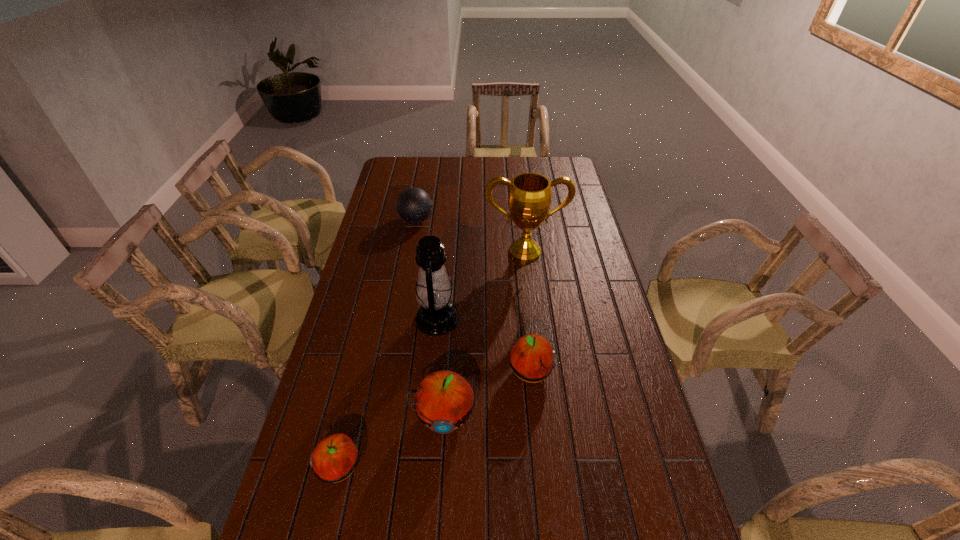
Select which object appears as the fifth closest to the bowling ball. Please provide its 2D coordinates. Your answer should be formatted as a tuple, i.e. [(x, y)], where the tuple contains the x and y coordinates of a point satisfying the conditions above.

[(335, 457)]

Select which apple is the closest to the bowling ball. Please provide its 2D coordinates. Your answer should be formatted as a tuple, i.e. [(x, y)], where the tuple contains the x and y coordinates of a point satisfying the conditions above.

[(532, 358)]

This screenshot has width=960, height=540. What are the coordinates of `the third closest apple to the farthest object` in the screenshot? It's located at (335, 457).

I want to click on free space in the image that satisfies the following two spatial constraints: 1. on the back side of the oil lamp; 2. on the grip area of the farthest object, so click(446, 220).

Where is `free space that satisfies the following two spatial constraints: 1. on the back side of the second apple from left to right; 2. on the grip area of the farthest object`? Image resolution: width=960 pixels, height=540 pixels. free space that satisfies the following two spatial constraints: 1. on the back side of the second apple from left to right; 2. on the grip area of the farthest object is located at coordinates (456, 220).

This screenshot has width=960, height=540. I want to click on free space that satisfies the following two spatial constraints: 1. on the back side of the rightmost apple; 2. on the left side of the shortest object, so click(x=362, y=373).

Where is `vacant position in the image that satisfies the following two spatial constraints: 1. on the grip area of the farthest object; 2. on the left side of the second apple from left to right`? The image size is (960, 540). vacant position in the image that satisfies the following two spatial constraints: 1. on the grip area of the farthest object; 2. on the left side of the second apple from left to right is located at coordinates (381, 416).